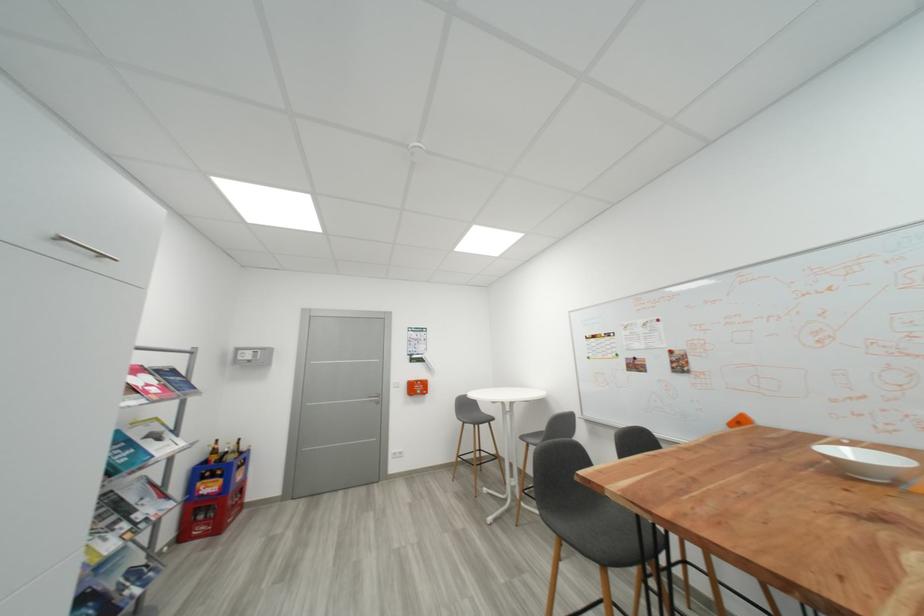
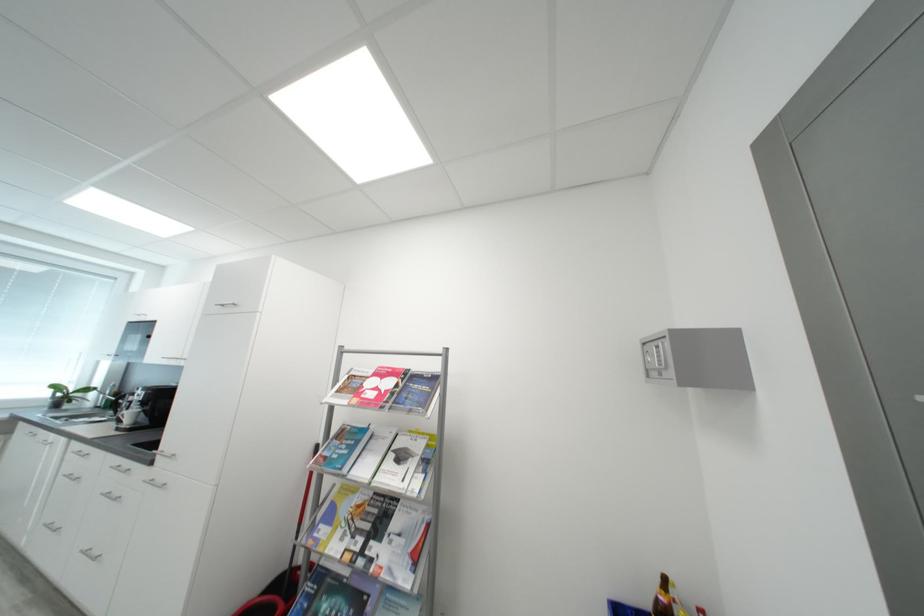
In the second image, find the point that corresponds to pixel 261 358 in the first image.

(666, 362)